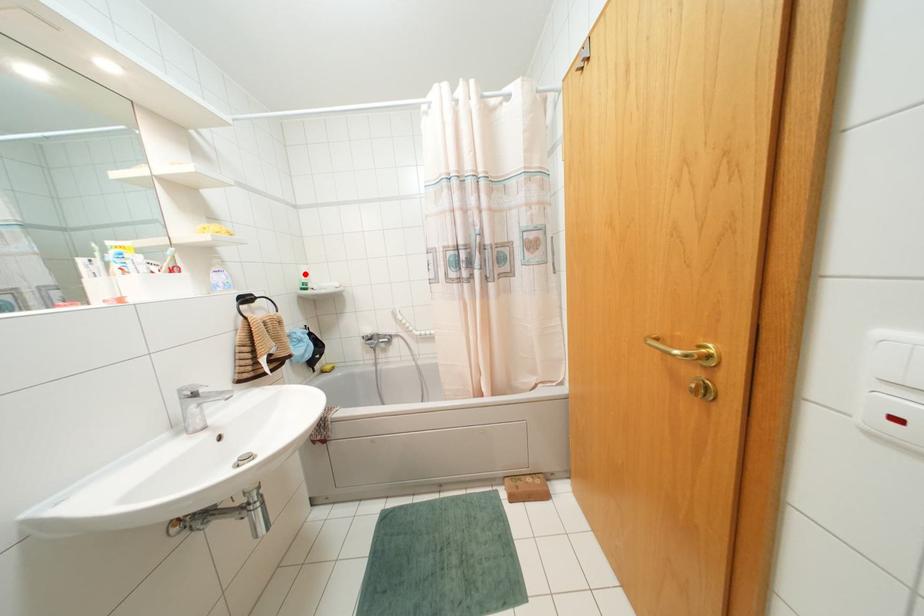
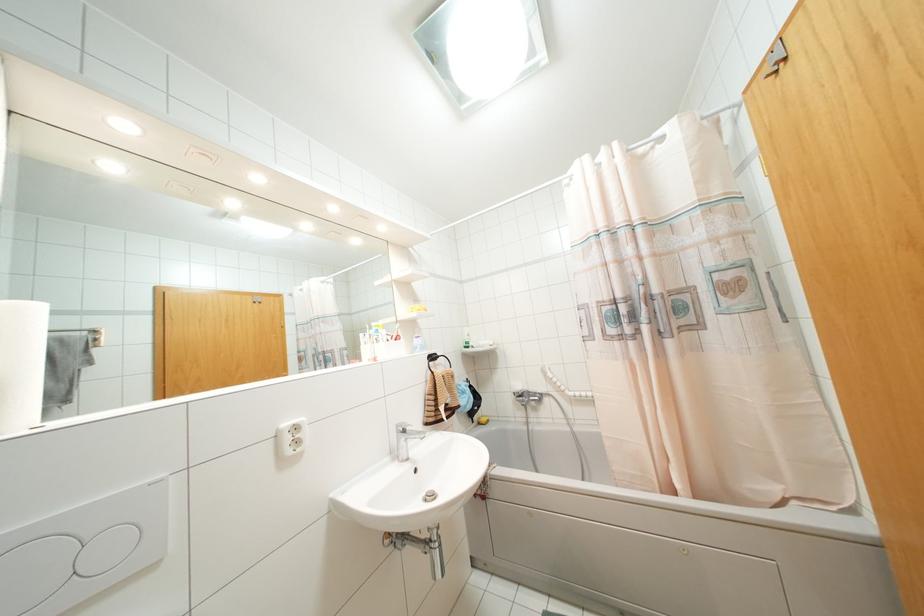
Locate, in the second image, the point that corresponds to the highlighted location in the first image.

(468, 334)